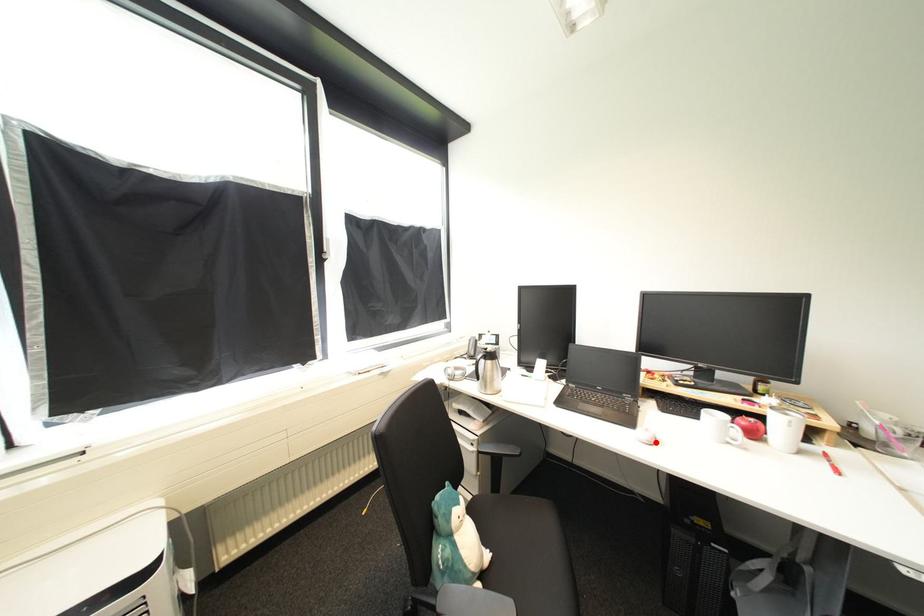
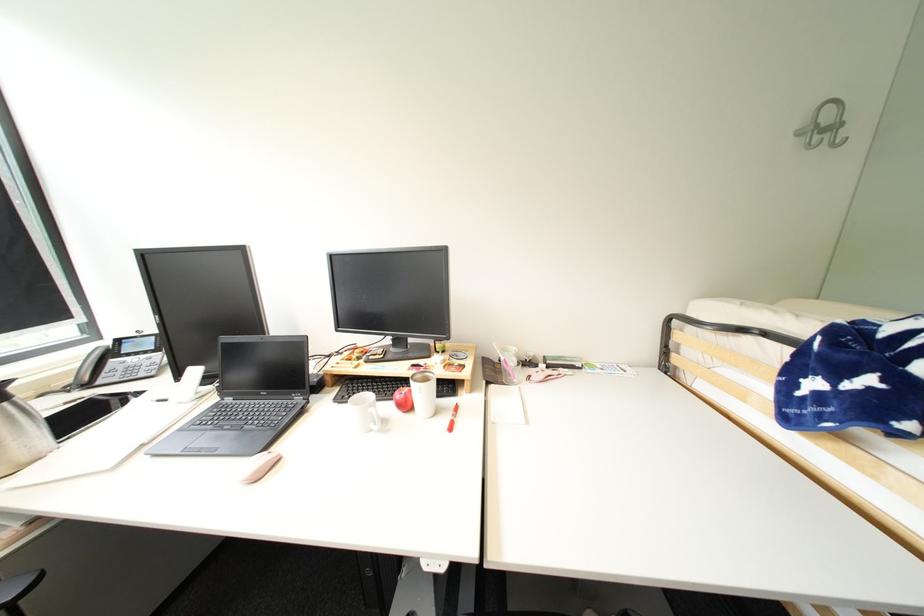
Question: I am providing you with two images of the same scene from different viewpoints. A red point is marked on the first image. Can you still see the location of the red point in image 2?

Choices:
 (A) Yes
 (B) No

Answer: (A)